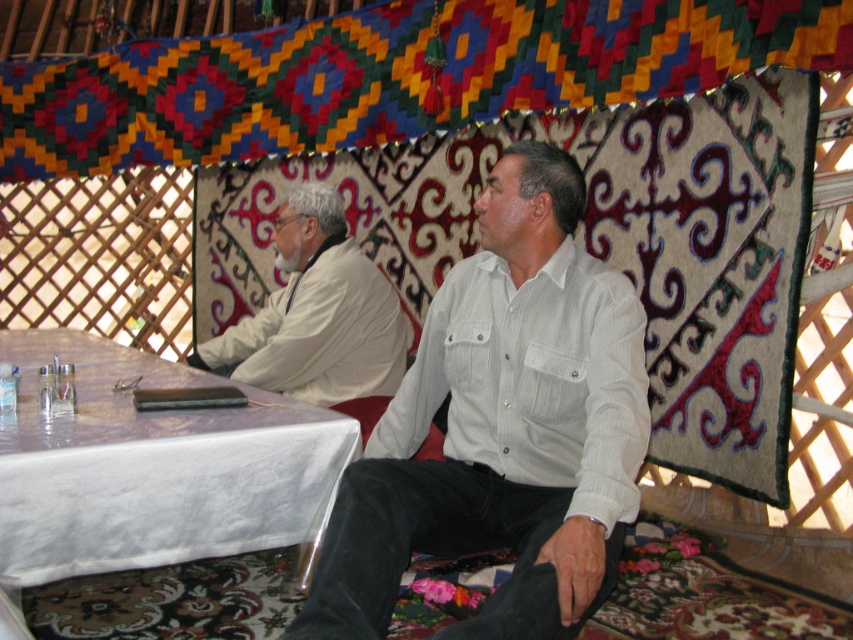
Question: Estimate the real-world distances between objects in this image. Which object is farther from the white cloth table at lower left?

Choices:
 (A) white matte shirt at upper left
 (B) white striped shirt at center

Answer: (A)

Question: Is white striped shirt at center smaller than white cloth table at lower left?

Choices:
 (A) yes
 (B) no

Answer: (A)

Question: Among these objects, which one is farthest from the camera?

Choices:
 (A) white matte shirt at upper left
 (B) white cloth table at lower left

Answer: (A)

Question: Which point is farther to the camera?

Choices:
 (A) (309, 275)
 (B) (270, 480)

Answer: (A)

Question: Does white striped shirt at center appear on the left side of white matte shirt at upper left?

Choices:
 (A) yes
 (B) no

Answer: (B)

Question: Can you confirm if white striped shirt at center is positioned to the right of white cloth table at lower left?

Choices:
 (A) no
 (B) yes

Answer: (B)